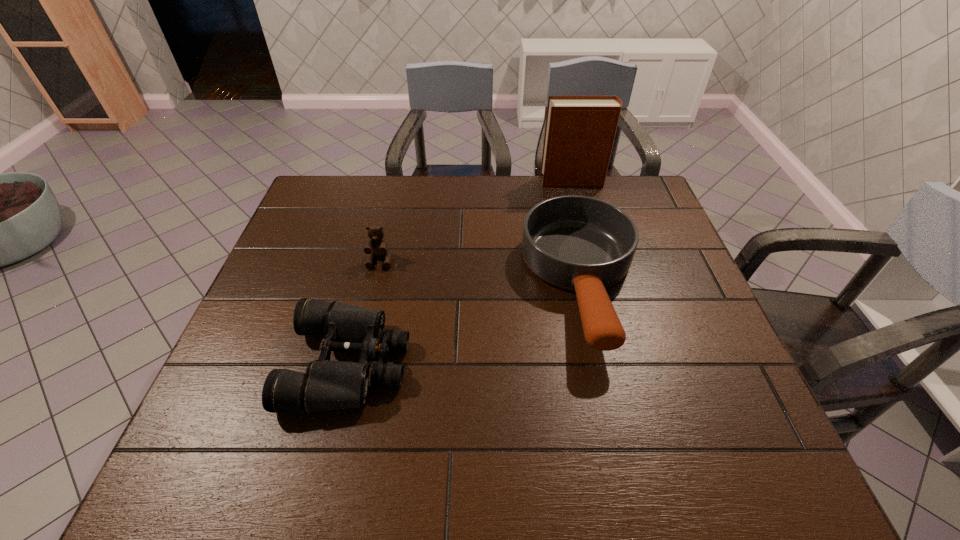
Locate an element on the screen. This screenshot has height=540, width=960. the farthest object is located at coordinates (580, 130).

This screenshot has height=540, width=960. In order to click on hardback book in this screenshot , I will do `click(580, 130)`.

Find the location of a particular element. Image resolution: width=960 pixels, height=540 pixels. pan is located at coordinates (579, 243).

Identify the location of teddy bear. The width and height of the screenshot is (960, 540). (376, 247).

The width and height of the screenshot is (960, 540). I want to click on binoculars, so click(327, 385).

Locate an element on the screen. The height and width of the screenshot is (540, 960). vacant space situated on the open cover of the farthest object is located at coordinates (424, 181).

This screenshot has height=540, width=960. Identify the location of vacant space located 0.390m on the open cover of the farthest object. (427, 181).

The width and height of the screenshot is (960, 540). I want to click on free space located 0.280m on the open cover of the farthest object, so click(460, 181).

Locate an element on the screen. The height and width of the screenshot is (540, 960). blank space located 0.080m on the handle side of the pan is located at coordinates (608, 401).

Identify the location of vacant space located on the face of the teddy bear. (369, 308).